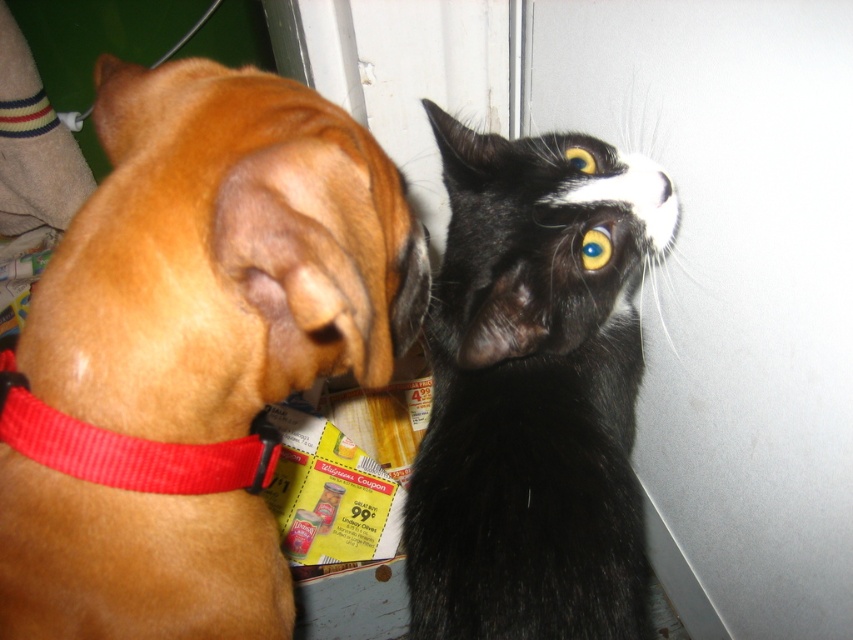
You are a photographer trying to capture a candid shot of both the black silky fur cat at upper right and the red fabric collar at left in the same frame. Based on their positions, which subject is closer to the bottom edge of the photo?

The black silky fur cat at upper right is located below the red fabric collar at left, so the cat is closer to the bottom edge of the photo.

You are a pet owner who wants to buy a new collar for your brown fur dog at left. The current red fabric collar at left is too small. Based on the image, can you determine if a collar labeled as size large would fit the dog?

The brown fur dog at left is larger in size than the red fabric collar at left. Therefore, a collar labeled as size large would likely fit the brown fur dog at left since it needs a bigger collar than the current one.

You are a pet photographer setting up a photo shoot. You have a black silky fur cat at upper right and a red fabric collar at left in your frame. Based on their sizes, which animal would you need to position closer to the camera to maintain a balanced composition?

The black silky fur cat at upper right is larger in size than the red fabric collar at left. To balance the composition, you should position the smaller red fabric collar at left closer to the camera so that its size in the frame matches the larger cat.